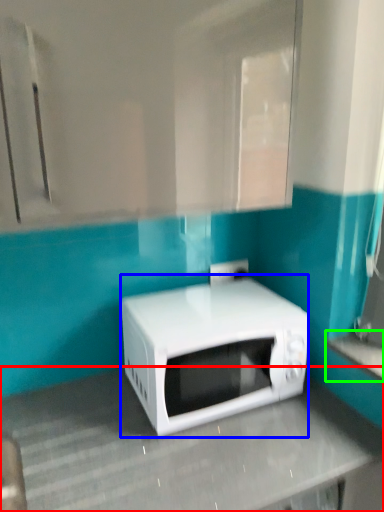
Question: Which object is positioned closest to counter top (highlighted by a red box)? Select from microwave oven (highlighted by a blue box) and counter top (highlighted by a green box).

Choices:
 (A) microwave oven
 (B) counter top

Answer: (A)